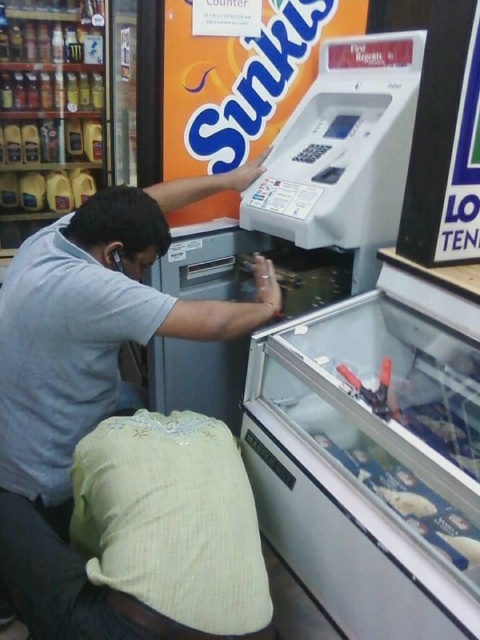
Question: Among these points, which one is nearest to the camera?

Choices:
 (A) (118, 228)
 (B) (365, 582)

Answer: (B)

Question: In this image, where is white plastic vending machine at lower right located relative to light blue shirt at center?

Choices:
 (A) below
 (B) above

Answer: (A)

Question: Can you confirm if white plastic vending machine at lower right is bigger than light blue shirt at center?

Choices:
 (A) no
 (B) yes

Answer: (A)

Question: Is white plastic vending machine at lower right to the left of light blue shirt at center from the viewer's perspective?

Choices:
 (A) no
 (B) yes

Answer: (A)